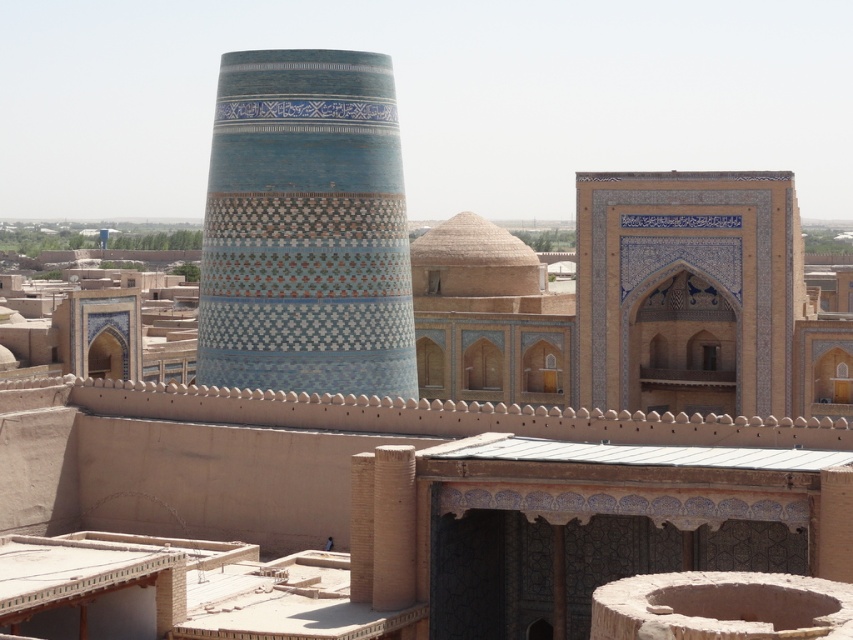
From the picture: You are standing in front of the historical complex and want to take a photo of the tower. The camera you have can focus on objects up to 80 meters away. Is the point at coordinates point (x=299, y=124) within the camera focus range?

The distance of point (x=299, y=124) from viewer is 77.41 meters, which is within the camera focus range of 80 meters. Yes, the point is within range.

You are an architect planning to replicate the design of the blue glazed tile tower at center and the blue glazed tile at center. If you want to ensure the replica of the tower is proportionally accurate, which one should you use as the reference for width?

The blue glazed tile tower at center has a smaller width than the blue glazed tile at center, so you should use the blue glazed tile at center as the reference for width to maintain proportional accuracy.

You are an architect visiting this historical site. You notice the blue glazed tile tower at center and the blue glazed tile at center. Which one is taller?

The blue glazed tile tower at center is much taller than the blue glazed tile at center.